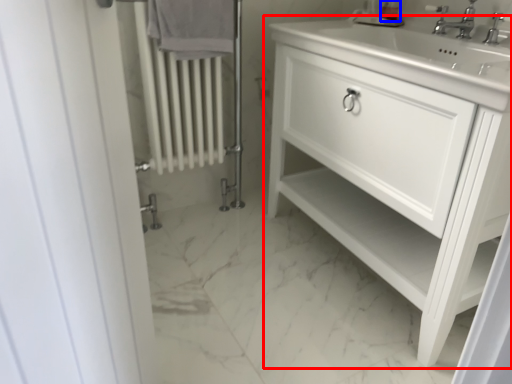
Question: Which object appears farthest to the camera in this image, bathroom cabinet (highlighted by a red box) or soap dispenser (highlighted by a blue box)?

Choices:
 (A) bathroom cabinet
 (B) soap dispenser

Answer: (B)